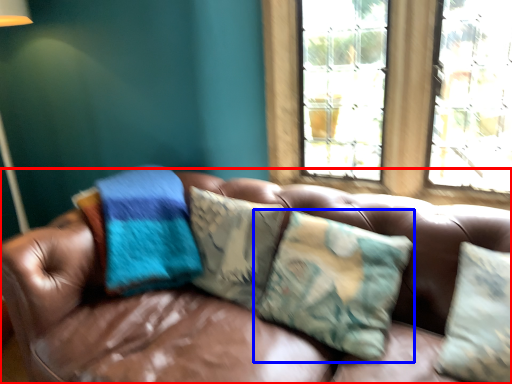
Question: Which object appears farthest to the camera in this image, studio couch (highlighted by a red box) or pillow (highlighted by a blue box)?

Choices:
 (A) studio couch
 (B) pillow

Answer: (B)